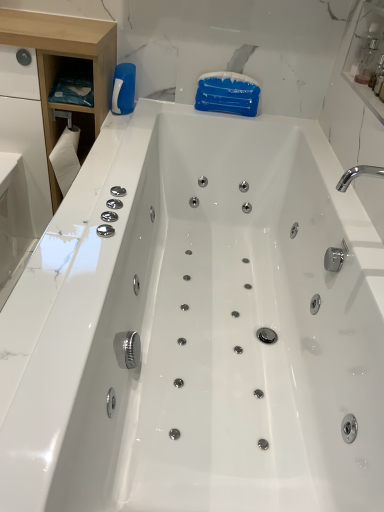
This screenshot has height=512, width=384. What do you see at coordinates (123, 89) in the screenshot? I see `white plastic bottle at upper left` at bounding box center [123, 89].

Image resolution: width=384 pixels, height=512 pixels. I want to click on transparent plastic bottle at upper right, so click(x=366, y=62).

Where is `white wood cabinet at left`? Image resolution: width=384 pixels, height=512 pixels. white wood cabinet at left is located at coordinates (63, 67).

From a real-world perspective, which object rests below the other?

white plastic bottle at upper left is physically lower.

Can you confirm if transparent plastic bottle at upper right is smaller than white plastic bottle at upper left?

Correct, transparent plastic bottle at upper right occupies less space than white plastic bottle at upper left.

Is transparent plastic bottle at upper right further to the viewer compared to white plastic bottle at upper left?

No, transparent plastic bottle at upper right is closer to the viewer.

From the image's perspective, which is above, transparent plastic bottle at upper right or white plastic bottle at upper left?

transparent plastic bottle at upper right, from the image's perspective.

How different are the orientations of white paper towel at left and white wood cabinet at left in degrees?

The angular difference between white paper towel at left and white wood cabinet at left is 0.61 degrees.

In the image, is white paper towel at left on the left side or the right side of white wood cabinet at left?

white paper towel at left is positioned on white wood cabinet at left's right side.

Considering the relative sizes of white paper towel at left and white wood cabinet at left in the image provided, is white paper towel at left bigger than white wood cabinet at left?

No, white paper towel at left is not bigger than white wood cabinet at left.

Where is `cabinetry above the white paper towel at left (from a real-world perspective)`? cabinetry above the white paper towel at left (from a real-world perspective) is located at coordinates (63, 67).

From the image's perspective, would you say white wood cabinet at left is positioned over white paper towel at left?

Yes, from the image's perspective, white wood cabinet at left is over white paper towel at left.

From a real-world perspective, which object rests below the other?

In real-world perspective, white paper towel at left is lower.

Could you tell me if white wood cabinet at left is turned towards white paper towel at left?

Yes, white wood cabinet at left is aimed at white paper towel at left.

Consider the image. Considering the sizes of white wood cabinet at left and white paper towel at left in the image, is white wood cabinet at left taller or shorter than white paper towel at left?

Clearly, white wood cabinet at left is taller compared to white paper towel at left.

Which is more to the left, transparent plastic bottle at upper right or white paper towel at left?

Positioned to the left is white paper towel at left.

From the image's perspective, does transparent plastic bottle at upper right appear lower than white paper towel at left?

No, from the image's perspective, transparent plastic bottle at upper right is not beneath white paper towel at left.

Considering the positions of points (363, 52) and (79, 163), is point (363, 52) farther from camera compared to point (79, 163)?

No, it is in front of (79, 163).

In the image, is white plastic bottle at upper left positioned in front of or behind white paper towel at left?

Visually, white plastic bottle at upper left is located behind white paper towel at left.

Measure the distance between white plastic bottle at upper left and white paper towel at left.

11.50 inches.

Is white plastic bottle at upper left directly adjacent to white paper towel at left?

No, white plastic bottle at upper left is not next to white paper towel at left.

Is point (130, 86) positioned after point (55, 173)?

Yes, point (130, 86) is behind point (55, 173).

Is white paper towel at left touching white plastic bottle at upper left?

There is a gap between white paper towel at left and white plastic bottle at upper left.

Looking at their sizes, would you say white paper towel at left is wider or thinner than white plastic bottle at upper left?

Considering their sizes, white paper towel at left looks broader than white plastic bottle at upper left.

Based on the photo, which of these two, white paper towel at left or white plastic bottle at upper left, stands taller?

With more height is white paper towel at left.

From the picture: Is white paper towel at left turned away from white plastic bottle at upper left?

white paper towel at left is not turned away from white plastic bottle at upper left.

From the image's perspective, is white paper towel at left located above or below transparent plastic bottle at upper right?

white paper towel at left is situated lower than transparent plastic bottle at upper right in the image.

Between white paper towel at left and transparent plastic bottle at upper right, which one has more height?

white paper towel at left is taller.

From a real-world perspective, is white paper towel at left physically above transparent plastic bottle at upper right?

No.

This screenshot has width=384, height=512. What are the coordinates of `bottle that appears on the right of white plastic bottle at upper left` in the screenshot? It's located at (366, 62).

You are a GUI agent. You are given a task and a screenshot of the screen. Output one action in this format:
    pyautogui.click(x=<x>, y=<y>)
    Task: Click on the cabinetry in front of the white paper towel at left
    
    Given the screenshot: What is the action you would take?
    pyautogui.click(x=63, y=67)

Which object lies further to the anchor point white paper towel at left, transparent plastic bottle at upper right or white plastic bottle at upper left?

transparent plastic bottle at upper right is positioned further to the anchor white paper towel at left.

When comparing their distances from white wood cabinet at left, does transparent plastic bottle at upper right or white plastic bottle at upper left seem closer?

The object closer to white wood cabinet at left is white plastic bottle at upper left.

Based on their spatial positions, is white plastic bottle at upper left or white wood cabinet at left further from transparent plastic bottle at upper right?

The object further to transparent plastic bottle at upper right is white wood cabinet at left.

When comparing their distances from white paper towel at left, does white plastic bottle at upper left or white wood cabinet at left seem further?

Among the two, white plastic bottle at upper left is located further to white paper towel at left.

In the scene shown: When comparing their distances from white plastic bottle at upper left, does white paper towel at left or white wood cabinet at left seem further?

The object further to white plastic bottle at upper left is white paper towel at left.

Looking at the image, which one is located closer to transparent plastic bottle at upper right, white plastic bottle at upper left or white paper towel at left?

white plastic bottle at upper left lies closer to transparent plastic bottle at upper right than the other object.

From the image, which object appears to be farther from white paper towel at left, transparent plastic bottle at upper right or white wood cabinet at left?

transparent plastic bottle at upper right is positioned further to the anchor white paper towel at left.

Looking at the image, which one is located closer to transparent plastic bottle at upper right, white wood cabinet at left or white plastic bottle at upper left?

white plastic bottle at upper left is positioned closer to the anchor transparent plastic bottle at upper right.

The width and height of the screenshot is (384, 512). Identify the location of cleaning product between white paper towel at left and transparent plastic bottle at upper right. (123, 89).

Identify the location of toilet paper between white wood cabinet at left and transparent plastic bottle at upper right from left to right. point(66,158).

The width and height of the screenshot is (384, 512). Find the location of `toilet paper between white wood cabinet at left and white plastic bottle at upper left`. toilet paper between white wood cabinet at left and white plastic bottle at upper left is located at coordinates (66, 158).

This screenshot has width=384, height=512. I want to click on cleaning product between white wood cabinet at left and transparent plastic bottle at upper right from left to right, so click(x=123, y=89).